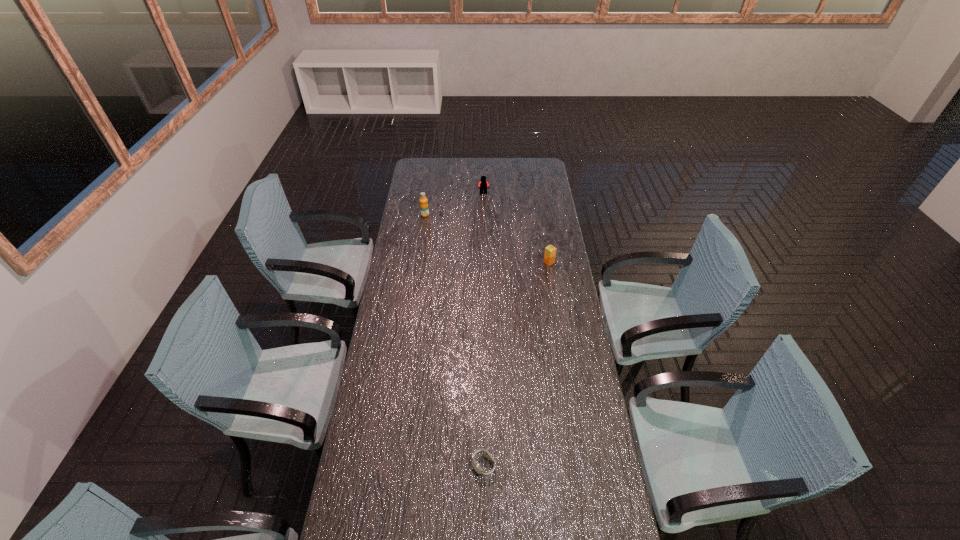
Find the location of `the farther orange juice`. the farther orange juice is located at coordinates (424, 208).

You are a GUI agent. You are given a task and a screenshot of the screen. Output one action in this format:
    pyautogui.click(x=<x>, y=<y>)
    Task: Click on the third nearest object
    The width and height of the screenshot is (960, 540).
    Given the screenshot: What is the action you would take?
    pyautogui.click(x=424, y=208)

Where is `the farthest object`? The image size is (960, 540). the farthest object is located at coordinates (483, 184).

The height and width of the screenshot is (540, 960). What are the coordinates of `the shorter orange juice` in the screenshot? It's located at (550, 251).

At what (x,y) coordinates should I click in order to perform the action: click on the second nearest object. Please return your answer as a coordinate pair (x, y). The width and height of the screenshot is (960, 540). Looking at the image, I should click on (550, 251).

The image size is (960, 540). What are the coordinates of `the shortest object` in the screenshot? It's located at (476, 466).

Find the location of a particular element. watch is located at coordinates (476, 466).

Locate an element on the screen. The height and width of the screenshot is (540, 960). vacant space located 0.350m on the label of the tallest object is located at coordinates (419, 260).

Find the location of `free region located 0.270m on the front-facing side of the farthest object`. free region located 0.270m on the front-facing side of the farthest object is located at coordinates (484, 224).

You are a GUI agent. You are given a task and a screenshot of the screen. Output one action in this format:
    pyautogui.click(x=<x>, y=<y>)
    Task: Click on the vacant space situated on the front of the right orange juice
    The image size is (960, 540).
    Given the screenshot: What is the action you would take?
    pyautogui.click(x=558, y=314)